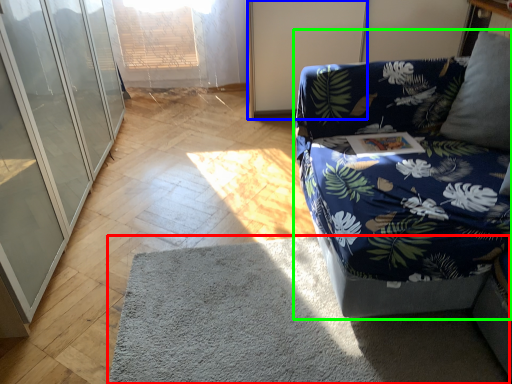
Question: Considering the real-world distances, which object is farthest from mat (highlighted by a red box)? screen door (highlighted by a blue box) or studio couch (highlighted by a green box)?

Choices:
 (A) screen door
 (B) studio couch

Answer: (A)